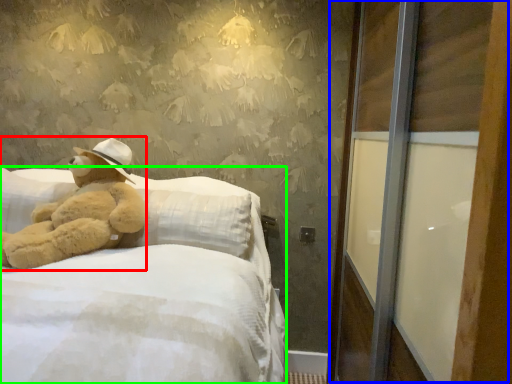
Question: Considering the real-world distances, which object is farthest from teddy bear (highlighted by a red box)? screen door (highlighted by a blue box) or bed (highlighted by a green box)?

Choices:
 (A) screen door
 (B) bed

Answer: (A)